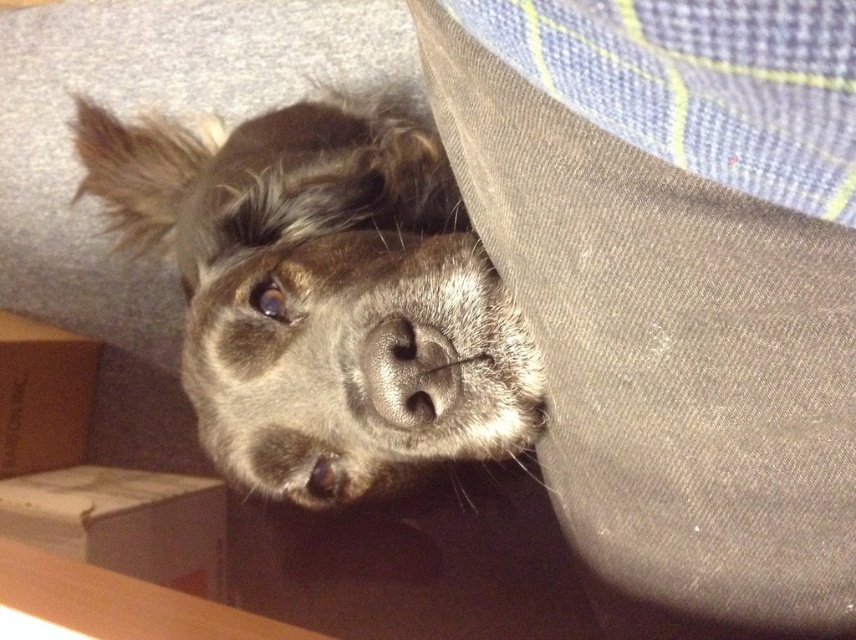
Does fuzzy brown dog at center have a greater width compared to sleek gray nose at center?

Yes.

Is fuzzy brown dog at center to the right of sleek gray nose at center from the viewer's perspective?

In fact, fuzzy brown dog at center is to the left of sleek gray nose at center.

Who is more forward, (373, 339) or (383, 324)?

Point (373, 339) is in front.

Find the location of a particular element. This screenshot has height=640, width=856. fuzzy brown dog at center is located at coordinates (322, 296).